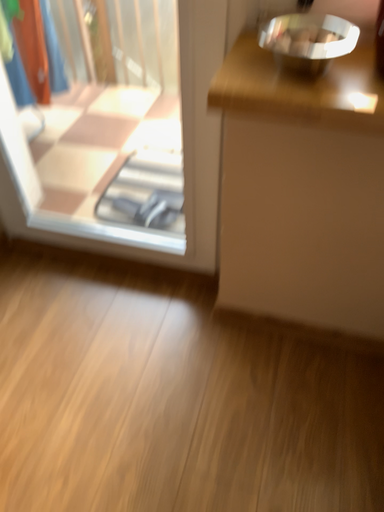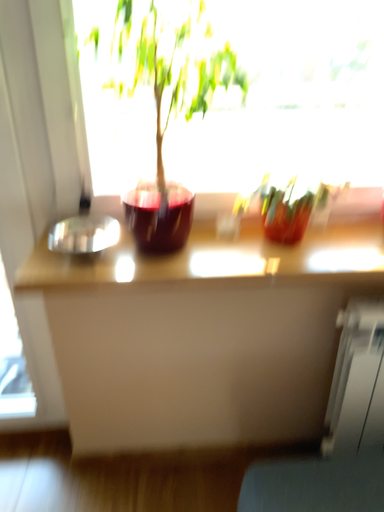
Question: Which way did the camera rotate in the video?

Choices:
 (A) rotated right
 (B) rotated left

Answer: (A)